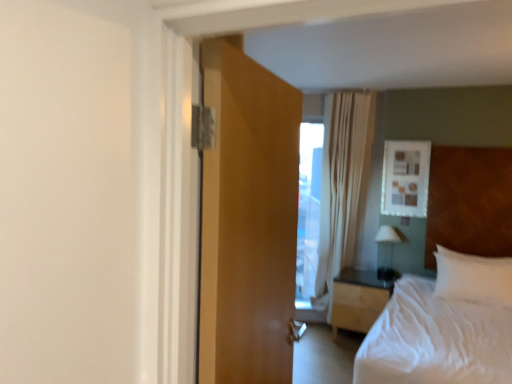
Measure the distance between point (x=225, y=262) and camera.

Point (x=225, y=262) is 1.12 meters from camera.

What is the approximate height of wooden door at center?

1.20 meters.

The image size is (512, 384). In order to click on white soft bed at right in this screenshot , I will do `click(435, 341)`.

Measure the distance between point (x=370, y=310) and camera.

The distance of point (x=370, y=310) from camera is 3.80 meters.

Where is `light wood/wooden nightstand at center`? light wood/wooden nightstand at center is located at coordinates (357, 300).

What is the approximate height of white sheer curtain at upper center?

white sheer curtain at upper center is 7.47 feet in height.

The image size is (512, 384). Find the location of `white sheer curtain at upper center`. white sheer curtain at upper center is located at coordinates (342, 185).

Locate an element on the screen. wooden door at center is located at coordinates (247, 220).

Find the location of a particular element. pillow below the white soft bed at right (from the image's perspective) is located at coordinates (473, 277).

Considering the sizes of objects white soft bed at right and white soft pillow at right in the image provided, who is thinner, white soft bed at right or white soft pillow at right?

Thinner between the two is white soft pillow at right.

Is white soft bed at right oriented towards white soft pillow at right?

No, white soft bed at right is not aimed at white soft pillow at right.

How far apart are white soft bed at right and white sheer curtain at upper center?

white soft bed at right and white sheer curtain at upper center are 1.38 meters apart.

Considering the sizes of objects white soft bed at right and white sheer curtain at upper center in the image provided, who is shorter, white soft bed at right or white sheer curtain at upper center?

white soft bed at right is shorter.

Is white soft bed at right turned away from white sheer curtain at upper center?

No.

Does white soft bed at right contain white sheer curtain at upper center?

No, white sheer curtain at upper center is located outside of white soft bed at right.

In the scene shown: From a real-world perspective, is white sheer curtain at upper center over white soft bed at right?

Yes, from a real-world perspective, white sheer curtain at upper center is on top of white soft bed at right.

In the scene shown: Who is bigger, white sheer curtain at upper center or white soft bed at right?

Bigger between the two is white soft bed at right.

From the image's perspective, which one is positioned lower, white sheer curtain at upper center or white soft bed at right?

white soft bed at right, from the image's perspective.

Is white sheer curtain at upper center far away from white soft bed at right?

white sheer curtain at upper center is far away from white soft bed at right.

Considering the relative sizes of white soft pillow at right and white soft bed at right in the image provided, is white soft pillow at right wider than white soft bed at right?

Incorrect, the width of white soft pillow at right does not surpass that of white soft bed at right.

Considering the sizes of objects white soft pillow at right and white soft bed at right in the image provided, who is bigger, white soft pillow at right or white soft bed at right?

With larger size is white soft bed at right.

Is white soft pillow at right closer to the viewer compared to white soft bed at right?

No, white soft pillow at right is further to the viewer.

Looking at this image, considering the sizes of objects white soft pillow at right and white soft bed at right in the image provided, who is taller, white soft pillow at right or white soft bed at right?

white soft bed at right is taller.

Is light wood/wooden nightstand at center not near white sheer curtain at upper center?

No.

Relative to white sheer curtain at upper center, is light wood/wooden nightstand at center in front or behind?

light wood/wooden nightstand at center is positioned closer to the viewer than white sheer curtain at upper center.

Is white sheer curtain at upper center at the back of light wood/wooden nightstand at center?

No, light wood/wooden nightstand at center is not facing the opposite direction of white sheer curtain at upper center.

Who is shorter, light wood/wooden nightstand at center or white sheer curtain at upper center?

With less height is light wood/wooden nightstand at center.

Are white sheer curtain at upper center and white glossy lamp at right located far from each other?

Actually, white sheer curtain at upper center and white glossy lamp at right are a little close together.

Is white sheer curtain at upper center located outside white glossy lamp at right?

Indeed, white sheer curtain at upper center is completely outside white glossy lamp at right.

Between white sheer curtain at upper center and white glossy lamp at right, which one has larger width?

white glossy lamp at right.

Who is smaller, white sheer curtain at upper center or white glossy lamp at right?

Smaller between the two is white glossy lamp at right.

Where is `bed above the white glossy lamp at right (from a real-world perspective)`? The height and width of the screenshot is (384, 512). bed above the white glossy lamp at right (from a real-world perspective) is located at coordinates (435, 341).

Considering the relative positions of white glossy lamp at right and white soft bed at right in the image provided, is white glossy lamp at right to the left of white soft bed at right from the viewer's perspective?

Indeed, white glossy lamp at right is positioned on the left side of white soft bed at right.

How many degrees apart are the facing directions of white glossy lamp at right and white soft bed at right?

The angular difference between white glossy lamp at right and white soft bed at right is 2.45 degrees.

This screenshot has width=512, height=384. What are the coordinates of `pillow on the right of white soft bed at right` in the screenshot? It's located at (473, 277).

You are a GUI agent. You are given a task and a screenshot of the screen. Output one action in this format:
    pyautogui.click(x=<x>, y=<y>)
    Task: Click on the bed that appears in front of the white sheer curtain at upper center
    
    Given the screenshot: What is the action you would take?
    pyautogui.click(x=435, y=341)

Consider the image. Considering their positions, is white soft pillow at right positioned closer to white sheer curtain at upper center than white glossy lamp at right?

Based on the image, white glossy lamp at right appears to be nearer to white sheer curtain at upper center.

From the image, which object appears to be nearer to white soft pillow at right, light wood/wooden nightstand at center or white sheer curtain at upper center?

light wood/wooden nightstand at center.

Based on the photo, considering their positions, is wooden door at center positioned closer to light wood/wooden nightstand at center than white sheer curtain at upper center?

white sheer curtain at upper center is positioned closer to the anchor light wood/wooden nightstand at center.

From the image, which object appears to be farther from wooden door at center, white soft pillow at right or white soft bed at right?

white soft pillow at right.

Considering their positions, is light wood/wooden nightstand at center positioned further to white sheer curtain at upper center than white soft pillow at right?

white soft pillow at right lies further to white sheer curtain at upper center than the other object.

Consider the image. Looking at the image, which one is located further to white sheer curtain at upper center, white glossy lamp at right or white soft pillow at right?

Based on the image, white soft pillow at right appears to be further to white sheer curtain at upper center.

Considering their positions, is white soft bed at right positioned closer to white glossy lamp at right than white sheer curtain at upper center?

The object closer to white glossy lamp at right is white sheer curtain at upper center.

When comparing their distances from white sheer curtain at upper center, does white soft bed at right or light wood/wooden nightstand at center seem closer?

light wood/wooden nightstand at center is closer to white sheer curtain at upper center.

The height and width of the screenshot is (384, 512). I want to click on pillow located between white soft bed at right and white glossy lamp at right in the depth direction, so click(473, 277).

Identify the location of bed between wooden door at center and light wood/wooden nightstand at center along the z-axis. pos(435,341).

Locate an element on the screen. nightstand between white soft bed at right and white glossy lamp at right in the front-back direction is located at coordinates (357, 300).

Where is `pillow located between white soft bed at right and white sheer curtain at upper center in the depth direction`? pillow located between white soft bed at right and white sheer curtain at upper center in the depth direction is located at coordinates (473, 277).